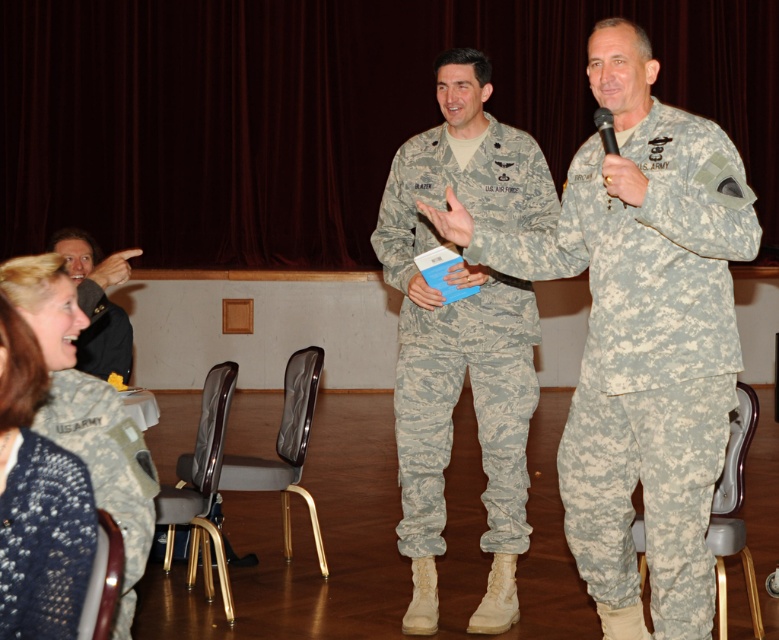
Measure the distance from camouflage fabric uniform at right to camouflage fabric uniform at lower left.

camouflage fabric uniform at right is 5.39 feet away from camouflage fabric uniform at lower left.

Does camouflage fabric uniform at right have a larger size compared to camouflage fabric uniform at lower left?

Yes, camouflage fabric uniform at right is bigger than camouflage fabric uniform at lower left.

Locate an element on the screen. The image size is (779, 640). camouflage fabric uniform at right is located at coordinates (647, 355).

At what (x,y) coordinates should I click in order to perform the action: click on camouflage fabric uniform at right. Please return your answer as a coordinate pair (x, y). This screenshot has width=779, height=640. Looking at the image, I should click on (647, 355).

Between camouflage fabric uniform at center and dark gray uniform at upper left, which one appears on the left side from the viewer's perspective?

dark gray uniform at upper left

Is point (404, 348) behind point (62, 250)?

No, it is not.

The width and height of the screenshot is (779, 640). In order to click on camouflage fabric uniform at center in this screenshot , I will do `click(473, 406)`.

Between camouflage fabric uniform at center and knitted blue sweater at lower left, which one is positioned lower?

knitted blue sweater at lower left is lower down.

Can you confirm if camouflage fabric uniform at center is positioned above knitted blue sweater at lower left?

Correct, camouflage fabric uniform at center is located above knitted blue sweater at lower left.

The image size is (779, 640). I want to click on camouflage fabric uniform at center, so click(473, 406).